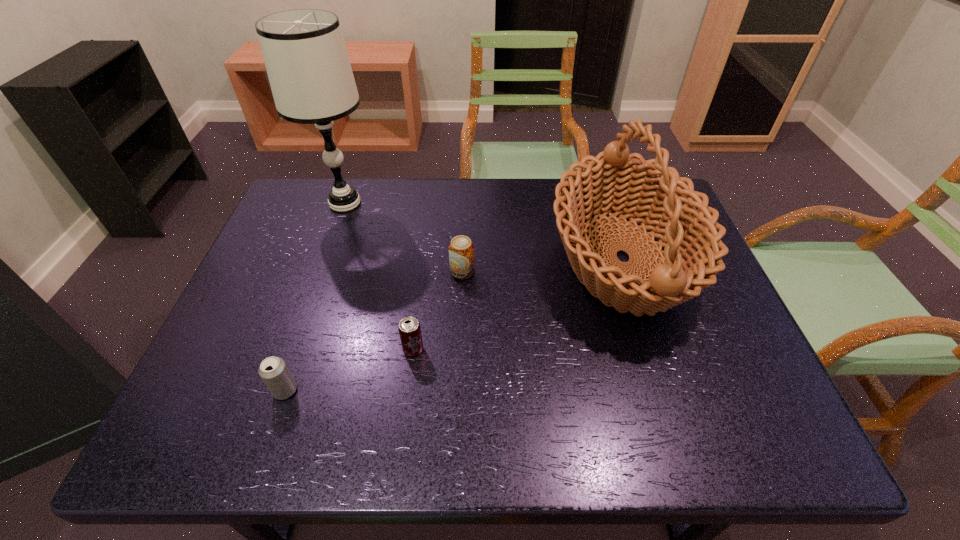
I want to click on free location that satisfies the following two spatial constraints: 1. on the back side of the nearest beer can; 2. on the right side of the rightmost beer can, so click(x=325, y=272).